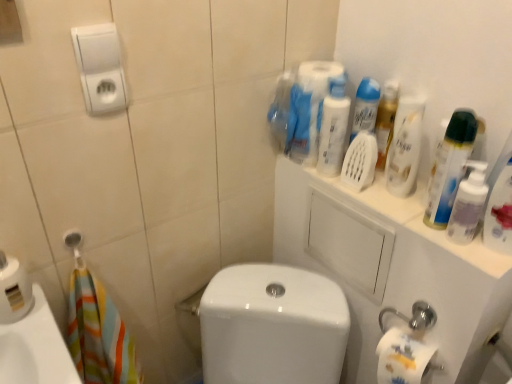
Question: Can you confirm if white glossy porcelain at center, arranged as the first porcelain when viewed from the left, is taller than translucent plastic bottle at upper right, the 2th cleaning product positioned from the right?

Choices:
 (A) yes
 (B) no

Answer: (A)

Question: Can you confirm if white glossy porcelain at center, arranged as the first porcelain when viewed from the left, is wider than translucent plastic bottle at upper right, the 2th cleaning product positioned from the right?

Choices:
 (A) yes
 (B) no

Answer: (A)

Question: Is white glossy porcelain at center, arranged as the first porcelain when viewed from the left, not within translucent plastic bottle at upper right, the 2th cleaning product positioned from the right?

Choices:
 (A) no
 (B) yes

Answer: (B)

Question: From a real-world perspective, is white glossy porcelain at center, placed as the 2th porcelain when sorted from right to left, on top of translucent plastic bottle at upper right, the 3th cleaning product from the left?

Choices:
 (A) no
 (B) yes

Answer: (A)

Question: From the image's perspective, is white glossy porcelain at center, arranged as the first porcelain when viewed from the left, on top of translucent plastic bottle at upper right, the 3th cleaning product from the left?

Choices:
 (A) no
 (B) yes

Answer: (A)

Question: From a real-world perspective, is translucent plastic spray bottle at upper right, the 1th cleaning product positioned from the right, positioned above or below white plastic hand dryer at upper left?

Choices:
 (A) above
 (B) below

Answer: (B)

Question: Is translucent plastic spray bottle at upper right, the fourth cleaning product from the left, situated inside white plastic hand dryer at upper left or outside?

Choices:
 (A) inside
 (B) outside

Answer: (B)

Question: Relative to white plastic hand dryer at upper left, is translucent plastic spray bottle at upper right, the 1th cleaning product positioned from the right, in front or behind?

Choices:
 (A) behind
 (B) front

Answer: (B)

Question: Looking at the image, does translucent plastic spray bottle at upper right, the 1th cleaning product positioned from the right, seem bigger or smaller compared to white plastic hand dryer at upper left?

Choices:
 (A) big
 (B) small

Answer: (A)

Question: Is translucent plastic bottle at upper right, acting as the first cleaning product starting from the left, wider or thinner than white glossy porcelain at center, arranged as the first porcelain when viewed from the left?

Choices:
 (A) thin
 (B) wide

Answer: (A)

Question: Is translucent plastic bottle at upper right, which is counted as the fourth cleaning product, starting from the right, inside the boundaries of white glossy porcelain at center, placed as the 2th porcelain when sorted from right to left, or outside?

Choices:
 (A) outside
 (B) inside

Answer: (A)

Question: From the image's perspective, is translucent plastic bottle at upper right, which is counted as the fourth cleaning product, starting from the right, positioned above or below white glossy porcelain at center, arranged as the first porcelain when viewed from the left?

Choices:
 (A) above
 (B) below

Answer: (A)

Question: Based on their positions, is translucent plastic bottle at upper right, which is counted as the fourth cleaning product, starting from the right, located to the left or right of white glossy porcelain at center, placed as the 2th porcelain when sorted from right to left?

Choices:
 (A) right
 (B) left

Answer: (A)

Question: From the image's perspective, is white glossy porcelain at center, placed as the 2th porcelain when sorted from right to left, above or below white glossy porcelain at upper right, marked as the first porcelain in a right-to-left arrangement?

Choices:
 (A) below
 (B) above

Answer: (A)

Question: Looking at the image, does white glossy porcelain at center, placed as the 2th porcelain when sorted from right to left, seem bigger or smaller compared to white glossy porcelain at upper right, which ranks as the second porcelain in left-to-right order?

Choices:
 (A) small
 (B) big

Answer: (A)